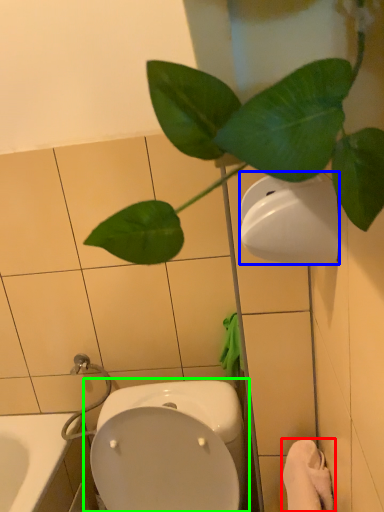
Question: Which object is the closest to the bath towel (highlighted by a red box)? Choose among these: toilet paper (highlighted by a blue box) or toilet (highlighted by a green box).

Choices:
 (A) toilet paper
 (B) toilet

Answer: (B)